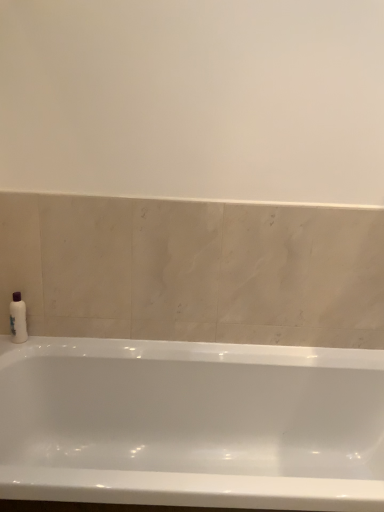
Question: Is white plastic bottle at left taller than white glossy bathtub at lower center?

Choices:
 (A) yes
 (B) no

Answer: (B)

Question: Can you confirm if white plastic bottle at left is smaller than white glossy bathtub at lower center?

Choices:
 (A) no
 (B) yes

Answer: (B)

Question: Is white plastic bottle at left in front of white glossy bathtub at lower center?

Choices:
 (A) no
 (B) yes

Answer: (A)

Question: Considering the relative positions of white plastic bottle at left and white glossy bathtub at lower center in the image provided, is white plastic bottle at left to the left of white glossy bathtub at lower center from the viewer's perspective?

Choices:
 (A) no
 (B) yes

Answer: (B)

Question: From a real-world perspective, is white plastic bottle at left located higher than white glossy bathtub at lower center?

Choices:
 (A) yes
 (B) no

Answer: (A)

Question: Is white plastic bottle at left behind white glossy bathtub at lower center?

Choices:
 (A) yes
 (B) no

Answer: (A)

Question: Considering the relative sizes of white glossy bathtub at lower center and white plastic bottle at left in the image provided, is white glossy bathtub at lower center thinner than white plastic bottle at left?

Choices:
 (A) no
 (B) yes

Answer: (A)

Question: Is white glossy bathtub at lower center at the right side of white plastic bottle at left?

Choices:
 (A) yes
 (B) no

Answer: (A)

Question: Does white glossy bathtub at lower center turn towards white plastic bottle at left?

Choices:
 (A) no
 (B) yes

Answer: (A)

Question: Considering the relative positions of white glossy bathtub at lower center and white plastic bottle at left in the image provided, is white glossy bathtub at lower center in front of white plastic bottle at left?

Choices:
 (A) yes
 (B) no

Answer: (A)

Question: Is white glossy bathtub at lower center positioned behind white plastic bottle at left?

Choices:
 (A) yes
 (B) no

Answer: (B)

Question: Can you confirm if white glossy bathtub at lower center is smaller than white plastic bottle at left?

Choices:
 (A) yes
 (B) no

Answer: (B)

Question: Considering the positions of white plastic bottle at left and white glossy bathtub at lower center in the image, is white plastic bottle at left wider or thinner than white glossy bathtub at lower center?

Choices:
 (A) thin
 (B) wide

Answer: (A)